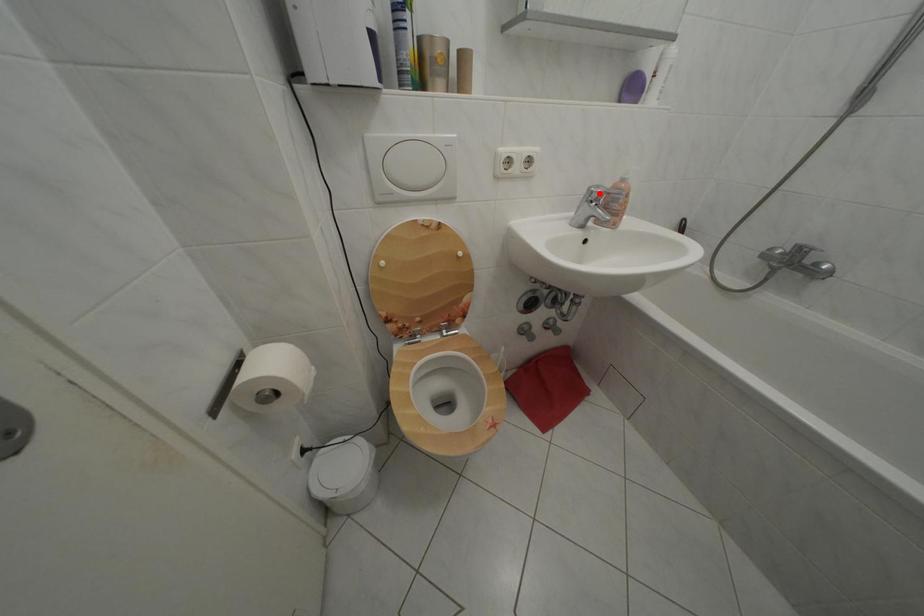
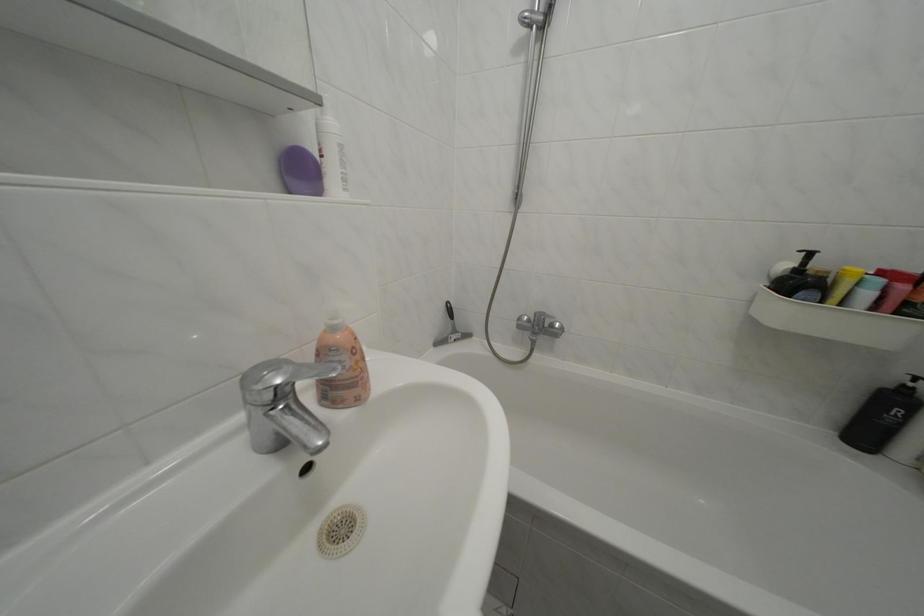
The point at the highlighted location is marked in the first image. Where is the corresponding point in the second image?

(252, 384)